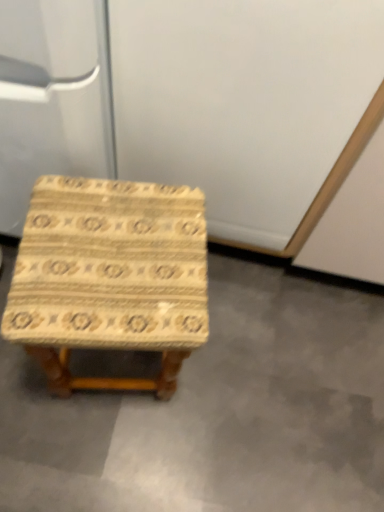
Locate an element on the screen. spots to the right of wooden-patterned stool at center is located at coordinates (235, 375).